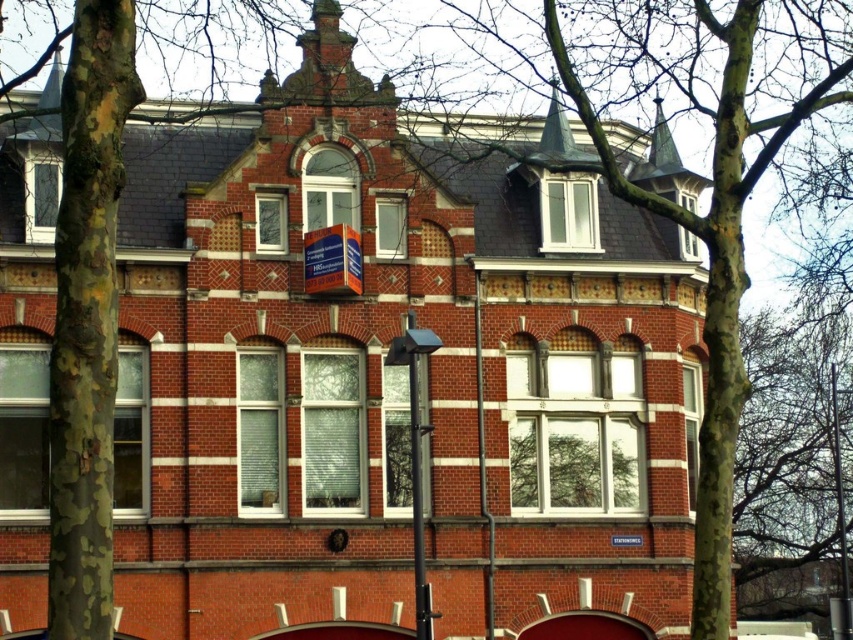
Question: Observing the image, what is the correct spatial positioning of black metal pole at center in reference to metallic pole at right?

Choices:
 (A) left
 (B) right

Answer: (A)

Question: In this image, where is black metal pole at center located relative to metallic pole at right?

Choices:
 (A) above
 (B) below

Answer: (A)

Question: Can you confirm if black metal pole at center is smaller than metallic pole at right?

Choices:
 (A) yes
 (B) no

Answer: (A)

Question: Which of the following is the closest to the observer?

Choices:
 (A) metallic pole at right
 (B) black metal pole at center

Answer: (B)